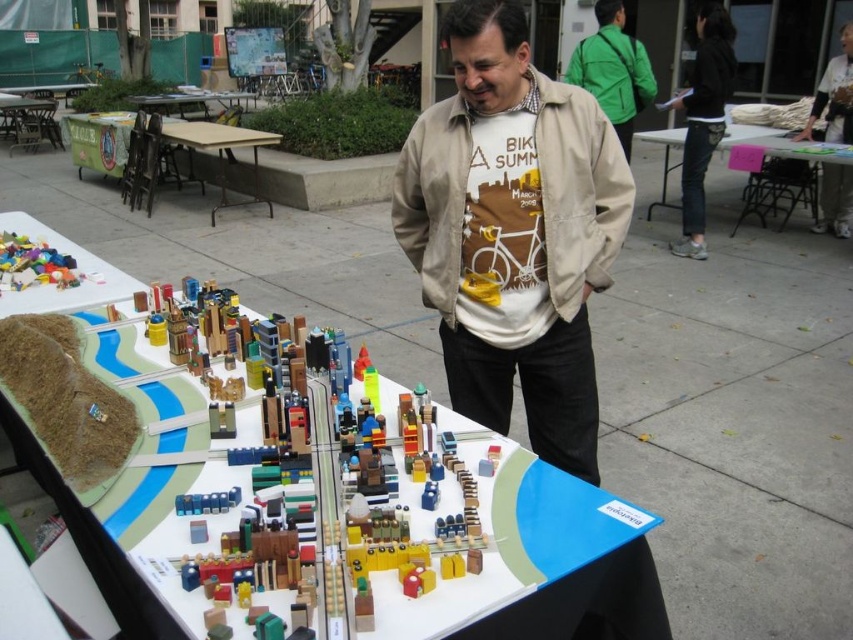
Question: Observing the image, what is the correct spatial positioning of green matte jacket at upper right in reference to wooden table at center?

Choices:
 (A) left
 (B) right

Answer: (B)

Question: Observing the image, what is the correct spatial positioning of beige cotton jacket at center in reference to plastic toy blocks at center?

Choices:
 (A) right
 (B) left

Answer: (A)

Question: Which point is farther to the camera?

Choices:
 (A) (33, 273)
 (B) (845, 234)

Answer: (B)

Question: Does plastic toy blocks at center have a greater width compared to white plastic table at upper left?

Choices:
 (A) yes
 (B) no

Answer: (B)

Question: Which of the following is the farthest from the observer?

Choices:
 (A) (757, 128)
 (B) (100, 262)

Answer: (A)

Question: Which object is the farthest from the multicolored plastic blocks at upper left?

Choices:
 (A) wooden table at left
 (B) pink paper at center
 (C) wooden blocks at center
 (D) plastic toy blocks at center

Answer: (A)